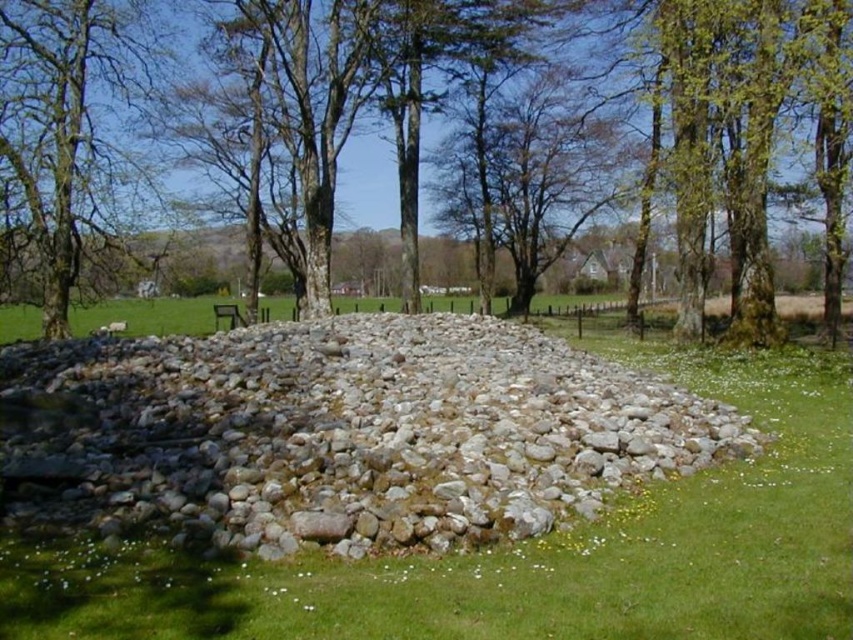
Question: Can you confirm if gray/rough stone at center is thinner than wooden park bench at center?

Choices:
 (A) yes
 (B) no

Answer: (B)

Question: Among these points, which one is farthest from the camera?

Choices:
 (A) (30, 208)
 (B) (126, 468)

Answer: (A)

Question: Which point appears closest to the camera in this image?

Choices:
 (A) (234, 326)
 (B) (473, 368)
 (C) (28, 198)
 (D) (335, 81)

Answer: (B)

Question: Can you confirm if gray/rough stone at center is positioned below wooden park bench at center?

Choices:
 (A) no
 (B) yes

Answer: (B)

Question: Based on their relative distances, which object is nearer to the brown rough tree at left?

Choices:
 (A) gray/rough stone at center
 (B) wooden park bench at center

Answer: (B)

Question: Does smooth bark tree at center have a larger size compared to wooden park bench at center?

Choices:
 (A) yes
 (B) no

Answer: (A)